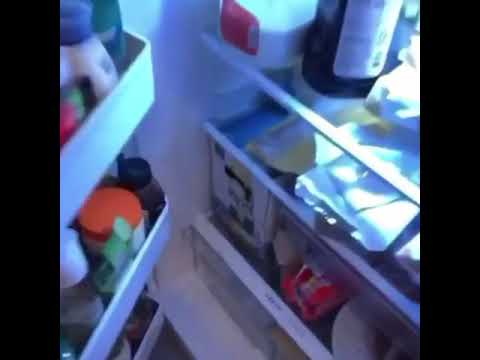
Where is `fridge`? This screenshot has width=480, height=360. fridge is located at coordinates (214, 107).